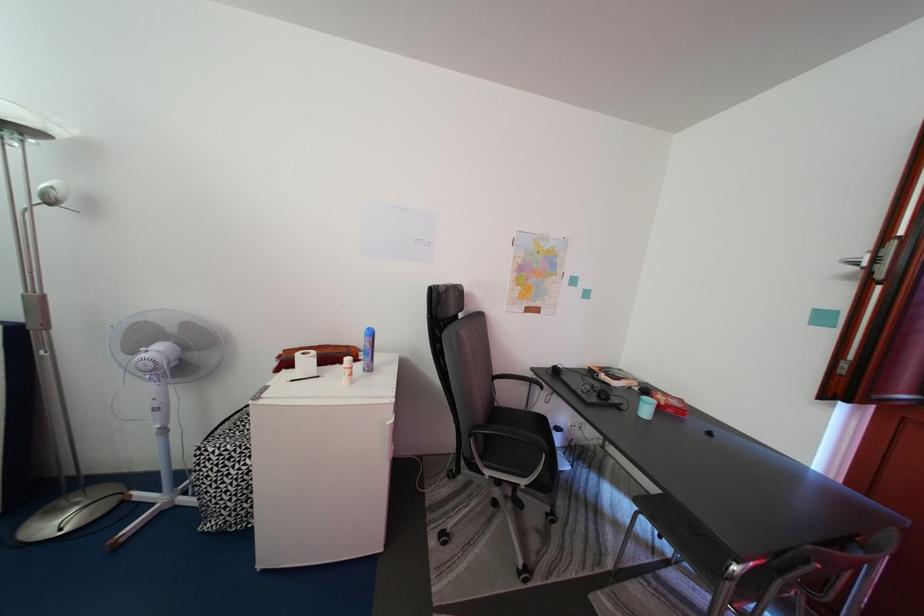
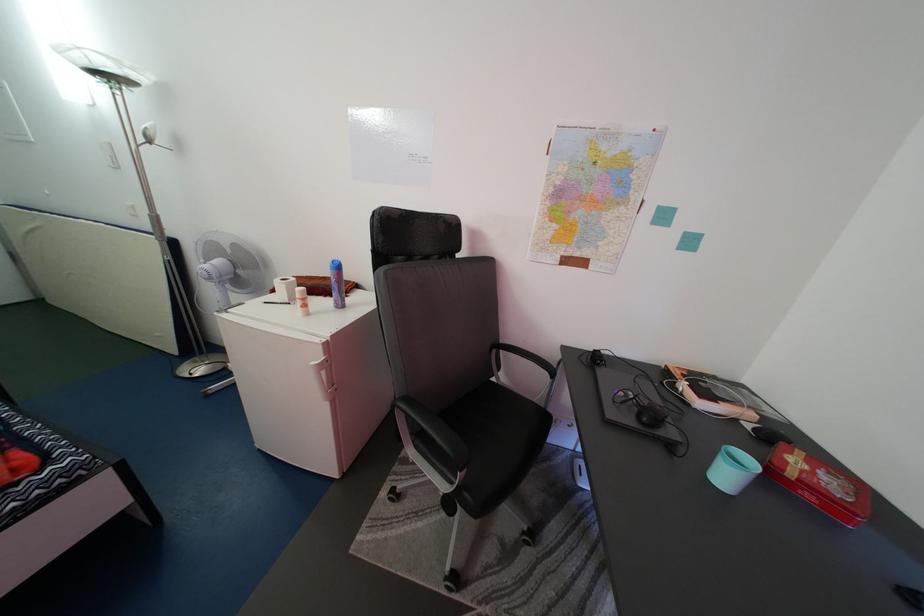
Find the pixel in the second image that matches [672,410] in the first image.

(799, 480)